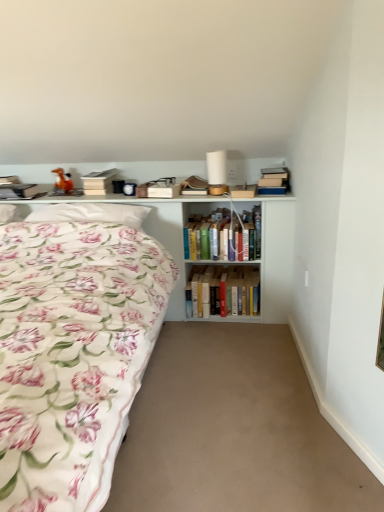
Question: From the image's perspective, is white soft pillow at upper left located above or below matte brown paperback book at upper center, which is counted as the second paperback book, starting from the right?

Choices:
 (A) below
 (B) above

Answer: (A)

Question: In the image, is white soft pillow at upper left on the left side or the right side of matte brown paperback book at upper center, which is counted as the second paperback book, starting from the right?

Choices:
 (A) right
 (B) left

Answer: (B)

Question: Which of these objects is positioned farthest from the hardcover book at upper center, which is the 3th paperback book in left-to-right order?

Choices:
 (A) hardcover books at center, the 1th book positioned from the bottom
 (B) floral fabric bed at left
 (C) orange matte toy horse at upper left
 (D) white matte paperback book at upper center, which is the third paperback book in right-to-left order
 (E) hardcover books at center, the 2th book positioned from the bottom

Answer: (B)

Question: Which object is the farthest from the white soft pillow at upper left?

Choices:
 (A) floral fabric bed at left
 (B) hardcover book at upper center, which is the 3th paperback book in left-to-right order
 (C) white matte paperback book at upper center, the 1th paperback book positioned from the left
 (D) white wooden shelf at upper left
 (E) beige carpet at center

Answer: (E)